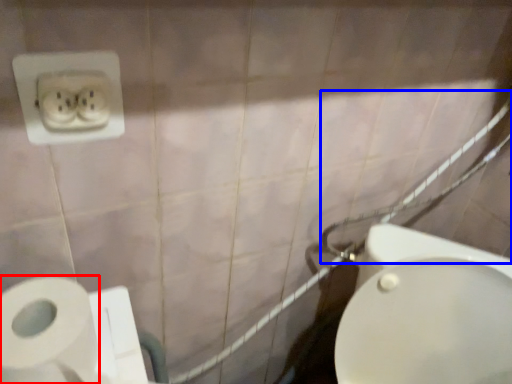
Question: Which point is closer to the camera, toilet paper (highlighted by a red box) or shower (highlighted by a blue box)?

Choices:
 (A) toilet paper
 (B) shower

Answer: (A)